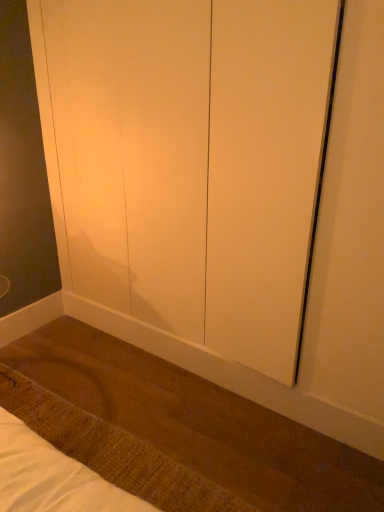
Describe the element at coordinates (113, 451) in the screenshot. I see `brown woven mat at lower left` at that location.

In order to click on brown woven mat at lower left in this screenshot , I will do `click(113, 451)`.

At what (x,y) coordinates should I click in order to perform the action: click on matte white screen door at center. Please return your answer as a coordinate pair (x, y). The height and width of the screenshot is (512, 384). Looking at the image, I should click on (194, 163).

Describe the element at coordinates (194, 163) in the screenshot. I see `matte white screen door at center` at that location.

Where is `brown woven mat at lower left`? This screenshot has width=384, height=512. brown woven mat at lower left is located at coordinates (113, 451).

Considering the relative positions of brown woven mat at lower left and matte white screen door at center in the image provided, is brown woven mat at lower left to the left of matte white screen door at center from the viewer's perspective?

Yes.

In the scene shown: Is brown woven mat at lower left closer to camera compared to matte white screen door at center?

No, brown woven mat at lower left is behind matte white screen door at center.

Does point (88, 453) come closer to viewer compared to point (160, 42)?

That is True.

From the image's perspective, is brown woven mat at lower left on top of matte white screen door at center?

Actually, brown woven mat at lower left appears below matte white screen door at center in the image.

From a real-world perspective, which is physically below, brown woven mat at lower left or matte white screen door at center?

brown woven mat at lower left is physically lower.

Considering the sizes of objects brown woven mat at lower left and matte white screen door at center in the image provided, who is wider, brown woven mat at lower left or matte white screen door at center?

brown woven mat at lower left is wider.

In the scene shown: In terms of height, does brown woven mat at lower left look taller or shorter compared to matte white screen door at center?

Clearly, brown woven mat at lower left is shorter compared to matte white screen door at center.

Between brown woven mat at lower left and matte white screen door at center, which one has smaller size?

With smaller size is brown woven mat at lower left.

In the scene shown: Could matte white screen door at center be considered to be inside brown woven mat at lower left?

No, matte white screen door at center is not a part of brown woven mat at lower left.

Is the surface of brown woven mat at lower left in direct contact with matte white screen door at center?

No, brown woven mat at lower left is not beside matte white screen door at center.

Could you tell me if brown woven mat at lower left is turned towards matte white screen door at center?

No, brown woven mat at lower left is not turned towards matte white screen door at center.

What's the angular difference between brown woven mat at lower left and matte white screen door at center's facing directions?

92.6 degrees.

The image size is (384, 512). What are the coordinates of `mat that is behind the matte white screen door at center` in the screenshot? It's located at (113, 451).

Considering the relative positions of matte white screen door at center and brown woven mat at lower left in the image provided, is matte white screen door at center to the right of brown woven mat at lower left from the viewer's perspective?

Indeed, matte white screen door at center is positioned on the right side of brown woven mat at lower left.

Which object is more forward, matte white screen door at center or brown woven mat at lower left?

matte white screen door at center.

Is point (158, 156) less distant than point (49, 439)?

No.

From the image's perspective, is matte white screen door at center above or below brown woven mat at lower left?

matte white screen door at center is situated higher than brown woven mat at lower left in the image.

From a real-world perspective, is matte white screen door at center located beneath brown woven mat at lower left?

Incorrect, from a real-world perspective, matte white screen door at center is higher than brown woven mat at lower left.

Between matte white screen door at center and brown woven mat at lower left, which one has smaller width?

Thinner between the two is matte white screen door at center.

Which of these two, matte white screen door at center or brown woven mat at lower left, stands shorter?

With less height is brown woven mat at lower left.

In the scene shown: Considering the relative sizes of matte white screen door at center and brown woven mat at lower left in the image provided, is matte white screen door at center bigger than brown woven mat at lower left?

Correct, matte white screen door at center is larger in size than brown woven mat at lower left.

Choose the correct answer: Is matte white screen door at center inside brown woven mat at lower left or outside it?

matte white screen door at center exists outside the volume of brown woven mat at lower left.

Does matte white screen door at center touch brown woven mat at lower left?

matte white screen door at center and brown woven mat at lower left are not in contact.

Does matte white screen door at center turn towards brown woven mat at lower left?

Yes.

What's the angular difference between matte white screen door at center and brown woven mat at lower left's facing directions?

The angular difference between matte white screen door at center and brown woven mat at lower left is 92.6 degrees.

How much distance is there between matte white screen door at center and brown woven mat at lower left?

A distance of 1.05 meters exists between matte white screen door at center and brown woven mat at lower left.

Identify the location of mat on the left of matte white screen door at center. (113, 451).

The width and height of the screenshot is (384, 512). What are the coordinates of `mat located on the left of matte white screen door at center` in the screenshot? It's located at (113, 451).

Where is `mat below the matte white screen door at center (from the image's perspective)`? mat below the matte white screen door at center (from the image's perspective) is located at coordinates (113, 451).